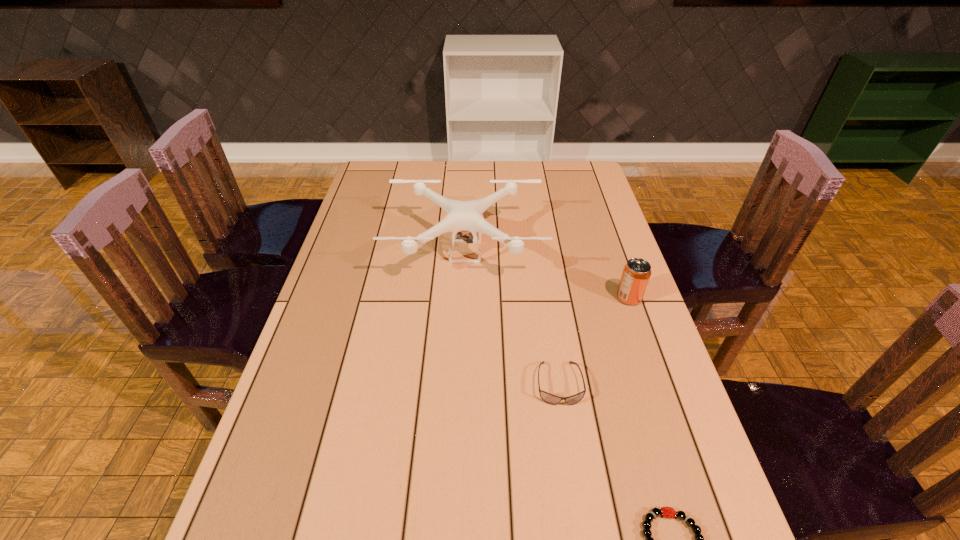
The width and height of the screenshot is (960, 540). What are the coordinates of `drone` in the screenshot? It's located at (462, 216).

This screenshot has width=960, height=540. I want to click on the tallest object, so click(462, 216).

Identify the location of the third shortest object. (636, 273).

This screenshot has width=960, height=540. In order to click on soda can in this screenshot , I will do `click(636, 273)`.

This screenshot has width=960, height=540. I want to click on sunglasses, so click(551, 399).

The image size is (960, 540). Identify the location of the second shortest object. (551, 399).

This screenshot has height=540, width=960. Identify the location of vacant region located 0.080m on the top of the drone. (464, 308).

Locate an element on the screen. The image size is (960, 540). vacant space located on the left of the soda can is located at coordinates (591, 298).

The image size is (960, 540). In order to click on free spot located on the lenses of the third farthest object in this screenshot , I will do `click(571, 464)`.

Where is `object at the right edge`? This screenshot has height=540, width=960. object at the right edge is located at coordinates (636, 273).